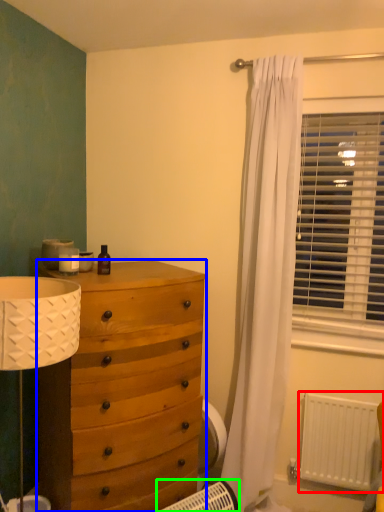
Question: Which object is positioned farthest from radiator (highlighted by a red box)? Select from chest of drawers (highlighted by a blue box) and heater (highlighted by a green box).

Choices:
 (A) chest of drawers
 (B) heater

Answer: (A)